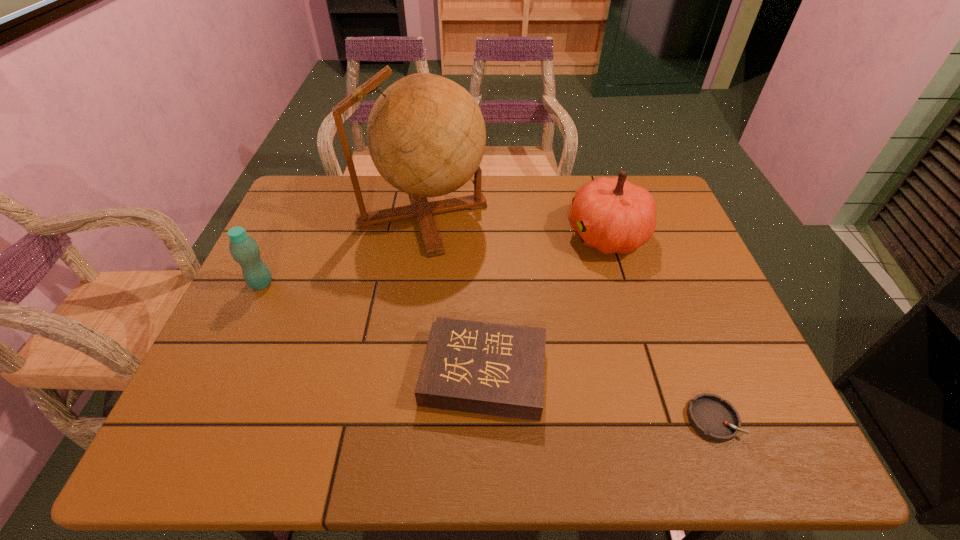
You are a GUI agent. You are given a task and a screenshot of the screen. Output one action in this format:
    pyautogui.click(x=<x>, y=<y>)
    Task: Click on the globe
    
    Given the screenshot: What is the action you would take?
    pyautogui.click(x=426, y=135)

At what (x,y) coordinates should I click in order to perform the action: click on pumpkin. Please return your answer as a coordinate pair (x, y). Looking at the image, I should click on (612, 215).

Find the location of a particular element. The image size is (960, 540). the leftmost object is located at coordinates (244, 250).

In order to click on the third shortest object in this screenshot , I will do `click(244, 250)`.

Find the location of a particular element. hardback book is located at coordinates (494, 369).

The image size is (960, 540). What are the coordinates of `the shortest object` in the screenshot? It's located at (713, 418).

Identify the location of free space located on the surface of the globe. (514, 214).

You are a GUI agent. You are given a task and a screenshot of the screen. Output one action in this format:
    pyautogui.click(x=<x>, y=<y>)
    Task: Click on the vacant region located 0.330m on the front-facing side of the fourth shortest object
    This screenshot has width=960, height=540.
    Given the screenshot: What is the action you would take?
    pyautogui.click(x=452, y=235)

Image resolution: width=960 pixels, height=540 pixels. I want to click on vacant space situated on the front-facing side of the fourth shortest object, so click(445, 235).

In order to click on free location located 0.310m on the front-facing side of the fourth shortest object in this screenshot , I will do click(x=459, y=235).